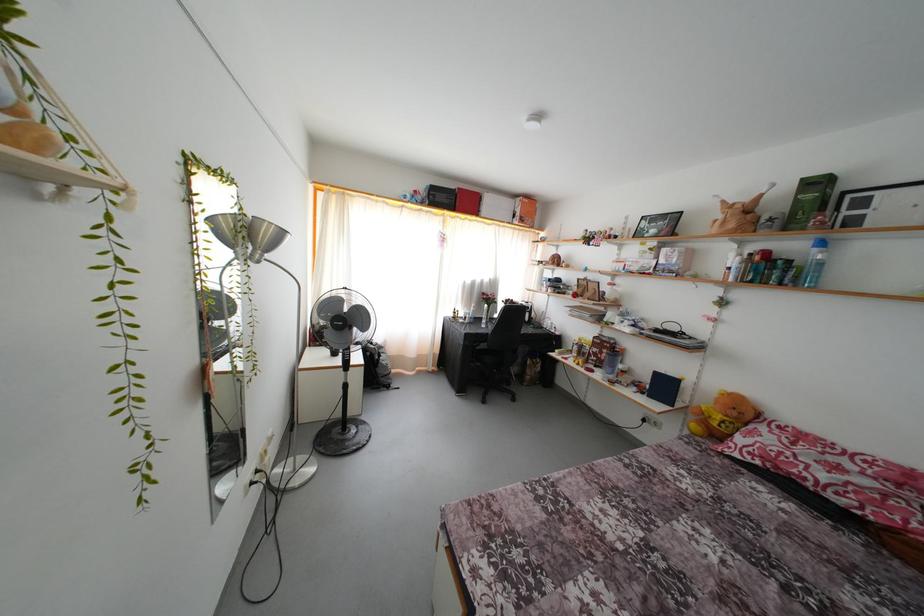
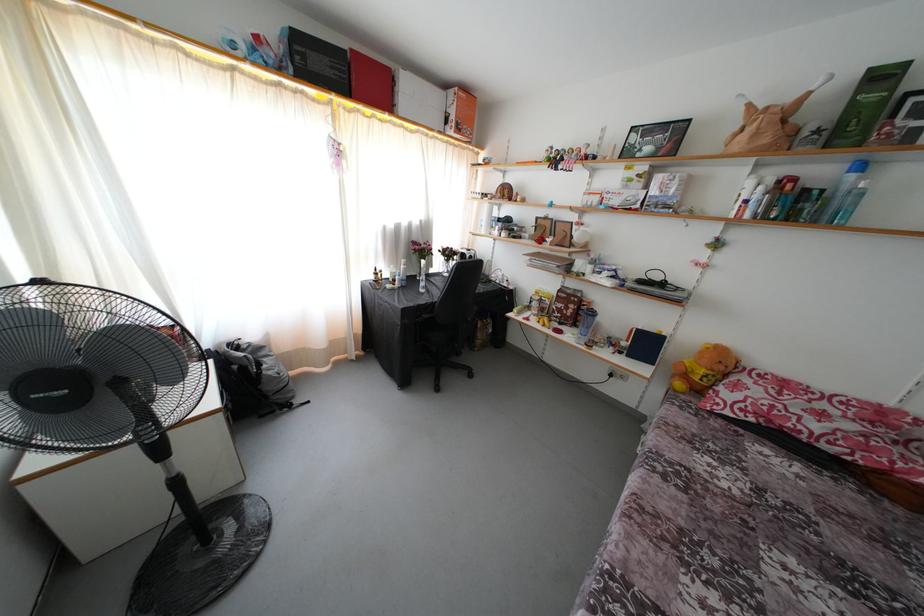
Where in the second image is the point corresponding to (x=387, y=386) from the first image?

(281, 403)